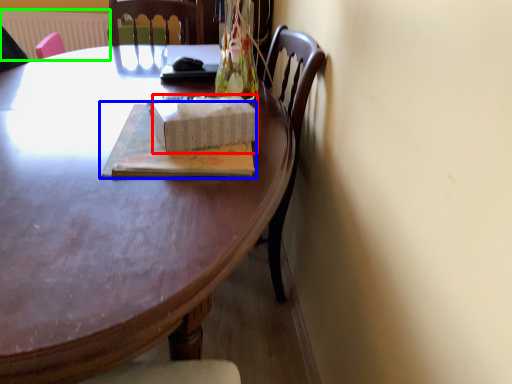
Question: Which object is positioned closest to box (highlighted by a red box)? Select from book (highlighted by a blue box) and radiator (highlighted by a green box).

Choices:
 (A) book
 (B) radiator

Answer: (A)